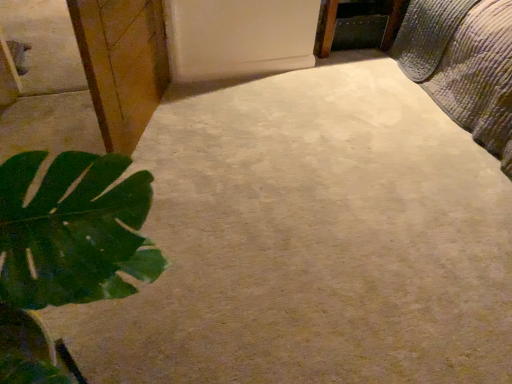
Question: Is wooden frame at upper right in contact with textured quilted bed at upper right?

Choices:
 (A) no
 (B) yes

Answer: (A)

Question: Does wooden frame at upper right have a smaller size compared to textured quilted bed at upper right?

Choices:
 (A) yes
 (B) no

Answer: (A)

Question: Would you say wooden frame at upper right contains textured quilted bed at upper right?

Choices:
 (A) no
 (B) yes

Answer: (A)

Question: Does wooden frame at upper right have a greater width compared to textured quilted bed at upper right?

Choices:
 (A) yes
 (B) no

Answer: (B)

Question: From the image's perspective, would you say wooden frame at upper right is shown under textured quilted bed at upper right?

Choices:
 (A) no
 (B) yes

Answer: (A)

Question: Is wooden frame at upper right bigger than textured quilted bed at upper right?

Choices:
 (A) yes
 (B) no

Answer: (B)

Question: Does wooden frame at upper right contain wooden cabinet at left?

Choices:
 (A) no
 (B) yes

Answer: (A)

Question: Is wooden frame at upper right at the right side of wooden cabinet at left?

Choices:
 (A) yes
 (B) no

Answer: (A)

Question: From the image's perspective, does wooden frame at upper right appear lower than wooden cabinet at left?

Choices:
 (A) yes
 (B) no

Answer: (B)

Question: Considering the relative sizes of wooden frame at upper right and wooden cabinet at left in the image provided, is wooden frame at upper right thinner than wooden cabinet at left?

Choices:
 (A) no
 (B) yes

Answer: (A)

Question: Is wooden frame at upper right wider than wooden cabinet at left?

Choices:
 (A) no
 (B) yes

Answer: (B)

Question: Is wooden frame at upper right facing away from wooden cabinet at left?

Choices:
 (A) no
 (B) yes

Answer: (A)

Question: Is textured quilted bed at upper right thinner than wooden cabinet at left?

Choices:
 (A) yes
 (B) no

Answer: (B)